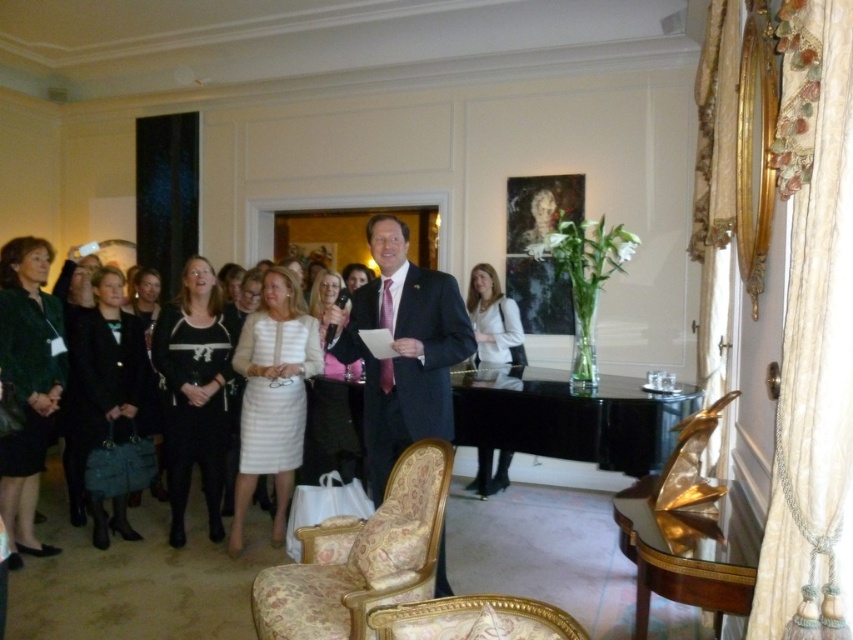
Question: Which of the following is the farthest from the observer?

Choices:
 (A) green velvet jacket at left
 (B) white matte dress at center
 (C) gold metallic armchair at lower right
 (D) matte black suit at center

Answer: (B)

Question: Does gold metallic armchair at lower right appear on the right side of white textured dress at center?

Choices:
 (A) yes
 (B) no

Answer: (A)

Question: Which object is closer to the camera taking this photo?

Choices:
 (A) floral-patterned fabric armchair at center
 (B) gold-patterned fabric armchair at lower center

Answer: (B)

Question: Does matte black suit at center have a smaller size compared to gold-patterned fabric armchair at lower center?

Choices:
 (A) no
 (B) yes

Answer: (A)

Question: Among these objects, which one is nearest to the camera?

Choices:
 (A) gold-patterned fabric armchair at lower center
 (B) matte black coat at left

Answer: (A)

Question: Does white textured dress at center have a lesser width compared to white matte dress at center?

Choices:
 (A) no
 (B) yes

Answer: (B)